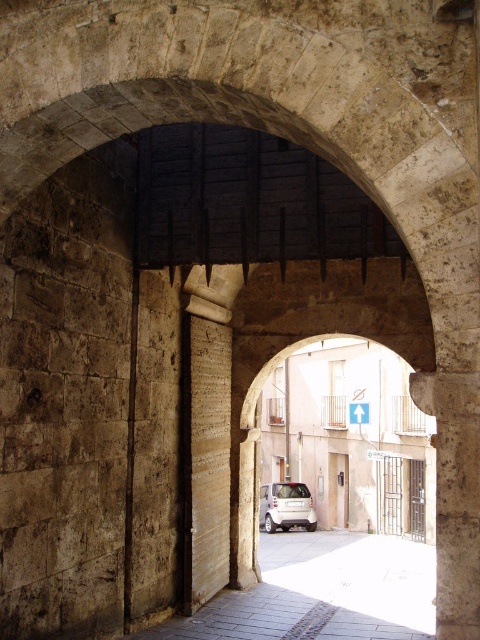
Question: Is smooth stone alley at center smaller than white matte car at center?

Choices:
 (A) yes
 (B) no

Answer: (B)

Question: Is smooth stone alley at center positioned at the back of white matte car at center?

Choices:
 (A) no
 (B) yes

Answer: (A)

Question: Can you confirm if smooth stone alley at center is thinner than white matte car at center?

Choices:
 (A) yes
 (B) no

Answer: (B)

Question: Among these objects, which one is nearest to the camera?

Choices:
 (A) white matte car at center
 (B) smooth stone alley at center

Answer: (B)